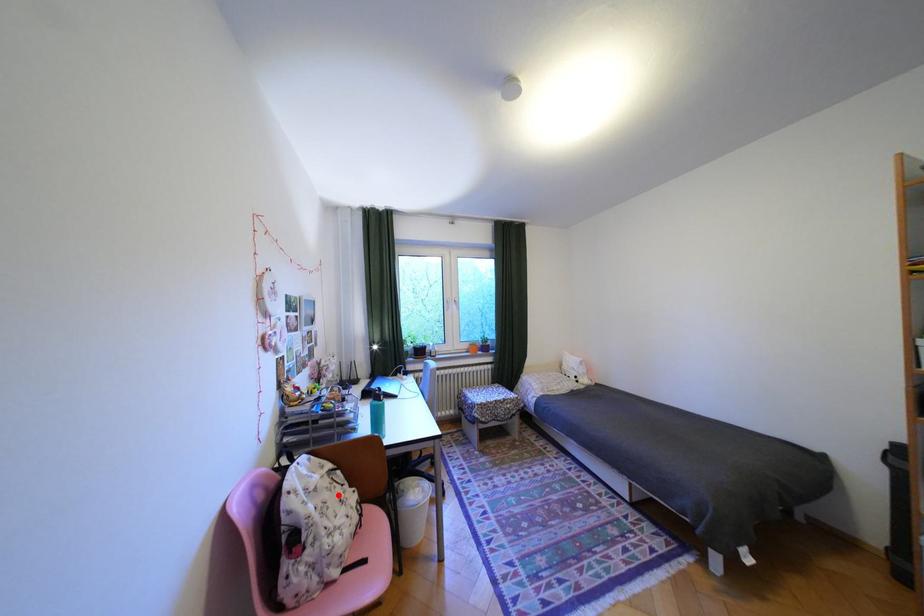
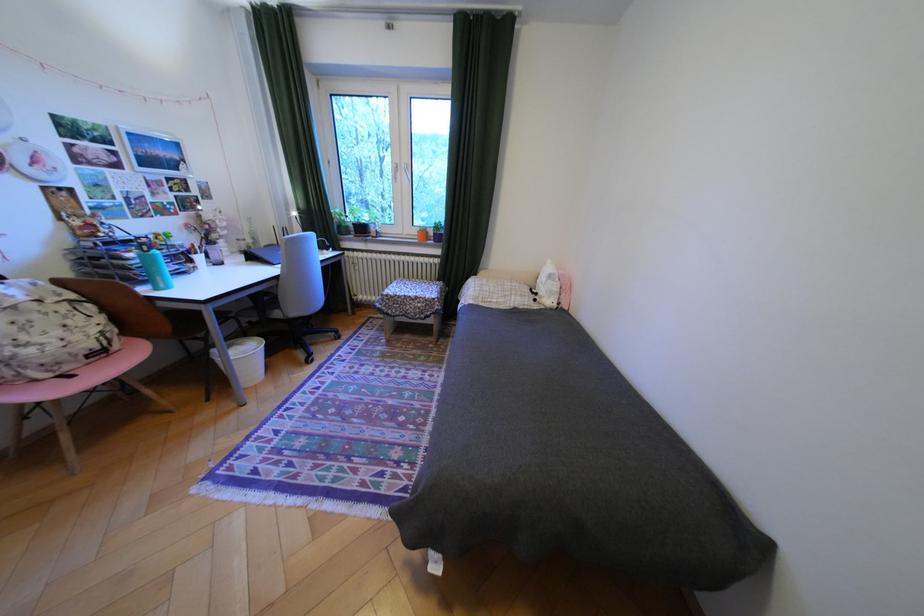
Where in the second image is the point corresponding to the highlighted location from the first image?

(49, 317)